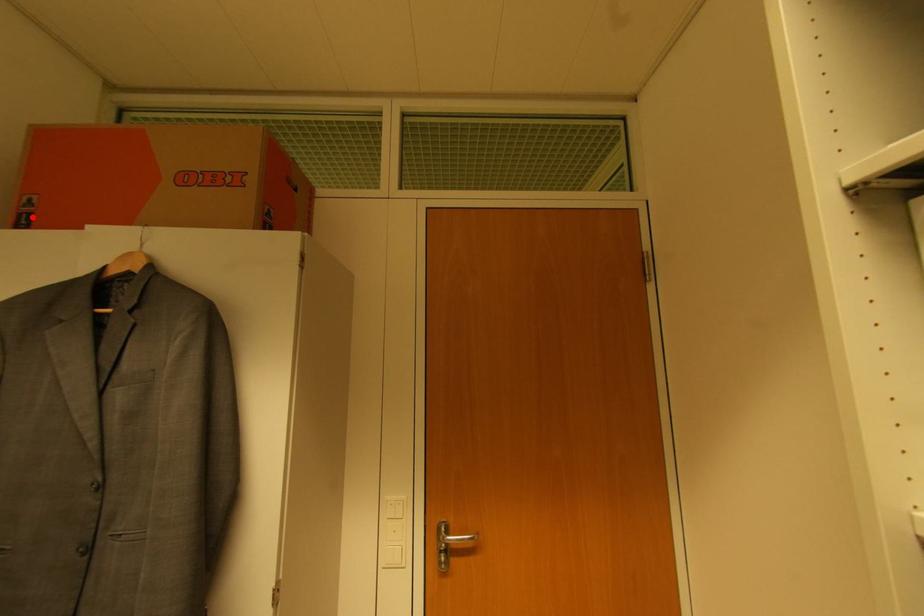
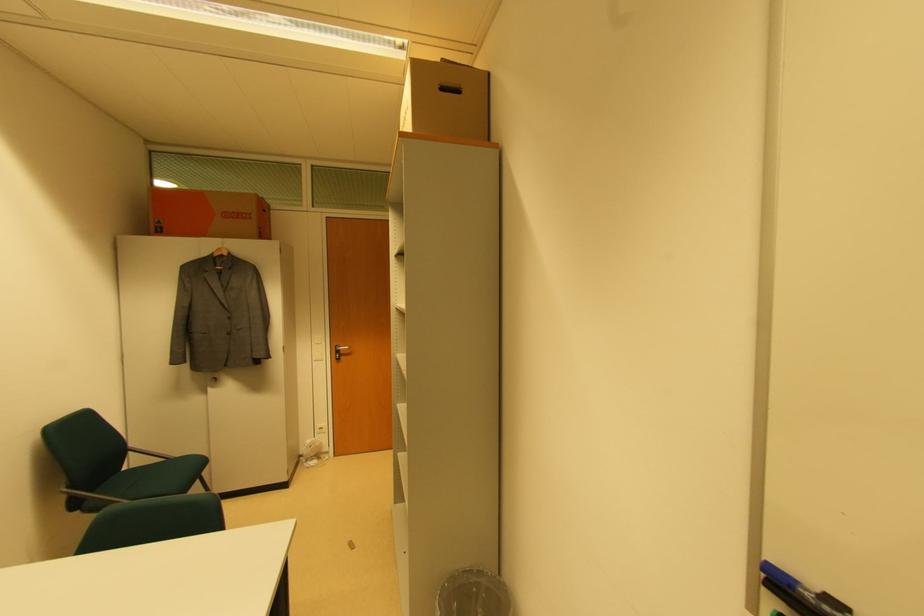
In the second image, find the point that corresponds to the highlighted location in the first image.

(163, 230)